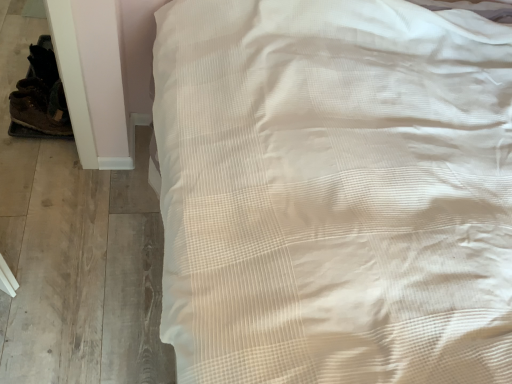
Question: Considering the relative sizes of white textured bed at upper right and brown leather shoe at left in the image provided, is white textured bed at upper right shorter than brown leather shoe at left?

Choices:
 (A) yes
 (B) no

Answer: (B)

Question: Is white textured bed at upper right facing towards brown leather shoe at left?

Choices:
 (A) no
 (B) yes

Answer: (B)

Question: Is white textured bed at upper right to the left of brown leather shoe at left from the viewer's perspective?

Choices:
 (A) no
 (B) yes

Answer: (A)

Question: Considering the relative sizes of white textured bed at upper right and brown leather shoe at left in the image provided, is white textured bed at upper right thinner than brown leather shoe at left?

Choices:
 (A) no
 (B) yes

Answer: (A)

Question: From a real-world perspective, is white textured bed at upper right below brown leather shoe at left?

Choices:
 (A) yes
 (B) no

Answer: (B)

Question: From the image's perspective, is white textured bed at upper right on brown leather shoe at left?

Choices:
 (A) yes
 (B) no

Answer: (B)

Question: Can you confirm if brown leather shoe at left is smaller than white textured bed at upper right?

Choices:
 (A) yes
 (B) no

Answer: (A)

Question: Is brown leather shoe at left taller than white textured bed at upper right?

Choices:
 (A) yes
 (B) no

Answer: (B)

Question: From a real-world perspective, is brown leather shoe at left physically above white textured bed at upper right?

Choices:
 (A) yes
 (B) no

Answer: (B)

Question: Is the depth of brown leather shoe at left greater than that of white textured bed at upper right?

Choices:
 (A) yes
 (B) no

Answer: (A)

Question: Can you confirm if brown leather shoe at left is thinner than white textured bed at upper right?

Choices:
 (A) no
 (B) yes

Answer: (B)

Question: Considering the relative positions of brown leather shoe at left and white textured bed at upper right in the image provided, is brown leather shoe at left in front of white textured bed at upper right?

Choices:
 (A) yes
 (B) no

Answer: (B)

Question: Does point (507, 152) appear closer or farther from the camera than point (57, 129)?

Choices:
 (A) farther
 (B) closer

Answer: (B)